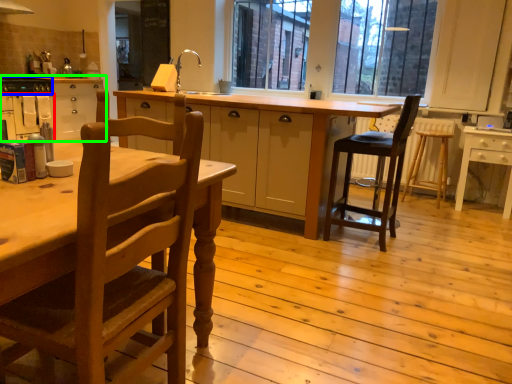
Question: Estimate the real-world distances between objects in this image. Which object is closer to oven (highlighted by a red box), appliance (highlighted by a blue box) or cabinetry (highlighted by a green box)?

Choices:
 (A) appliance
 (B) cabinetry

Answer: (B)